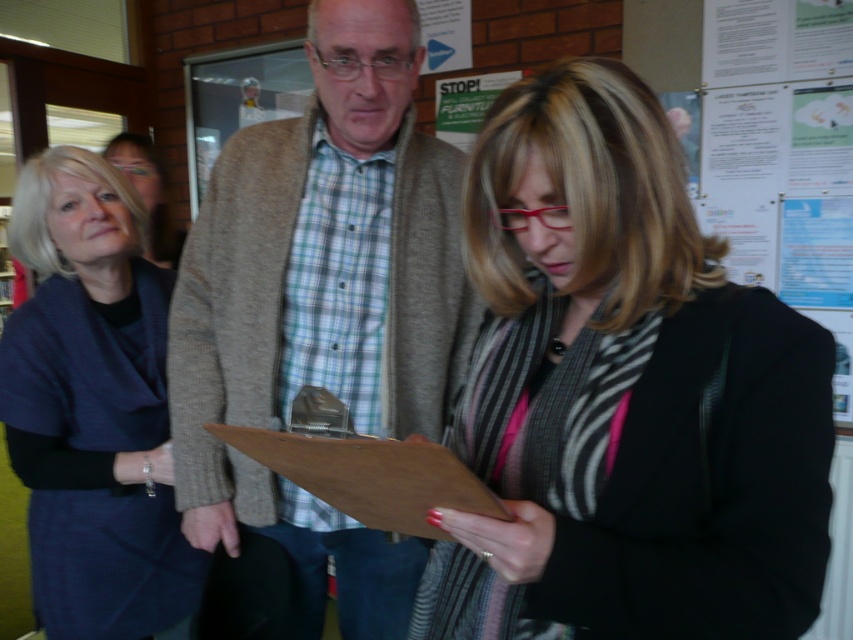
Question: Which object appears farthest from the camera in this image?

Choices:
 (A) wooden clipboard at center
 (B) white paper poster at upper right
 (C) dark blue fabric dress at left
 (D) gray wool sweater at center

Answer: (B)

Question: Estimate the real-world distances between objects in this image. Which object is closer to the wooden clipboard at center?

Choices:
 (A) gray wool sweater at center
 (B) matte black dress at left

Answer: (A)

Question: Does white paper poster at upper right have a smaller size compared to wooden clipboard at center?

Choices:
 (A) no
 (B) yes

Answer: (A)

Question: Estimate the real-world distances between objects in this image. Which object is farther from the white paper poster at upper right?

Choices:
 (A) matte black clipboard at center
 (B) wooden clipboard at center
 (C) gray wool sweater at center
 (D) dark blue fabric dress at left

Answer: (B)

Question: Does dark blue fabric dress at left have a lesser width compared to white paper poster at upper right?

Choices:
 (A) yes
 (B) no

Answer: (A)

Question: Is matte black clipboard at center thinner than wooden clipboard at center?

Choices:
 (A) yes
 (B) no

Answer: (B)